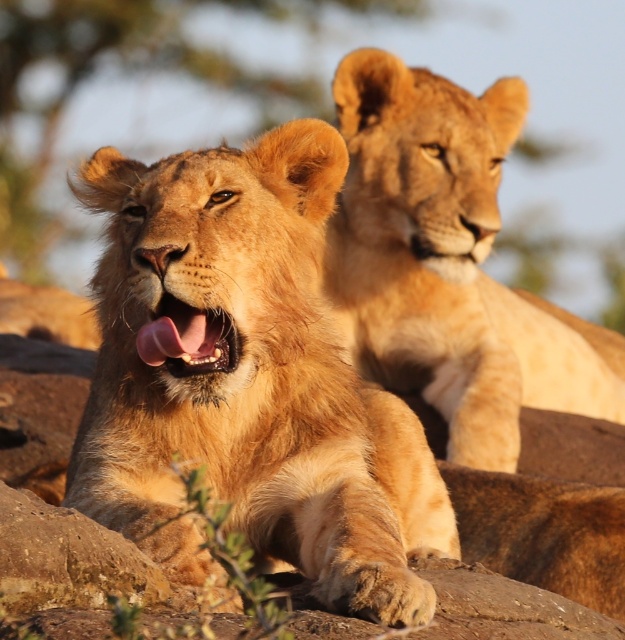
Question: Which point is farther to the camera?

Choices:
 (A) (442, 312)
 (B) (271, 444)
 (C) (218, 323)

Answer: (A)

Question: Is golden fur lion at upper center closer to camera compared to pink glossy tongue at center?

Choices:
 (A) yes
 (B) no

Answer: (B)

Question: Estimate the real-world distances between objects in this image. Which object is farther from the golden fur lion at upper center?

Choices:
 (A) pink glossy tongue at center
 (B) golden fur lion at center

Answer: (A)

Question: Does golden fur lion at upper center appear on the right side of pink glossy tongue at center?

Choices:
 (A) yes
 (B) no

Answer: (A)

Question: Is golden fur lion at upper center closer to the viewer compared to pink glossy tongue at center?

Choices:
 (A) no
 (B) yes

Answer: (A)

Question: Which point appears farthest from the camera in this image?

Choices:
 (A) (168, 321)
 (B) (341, 609)

Answer: (A)